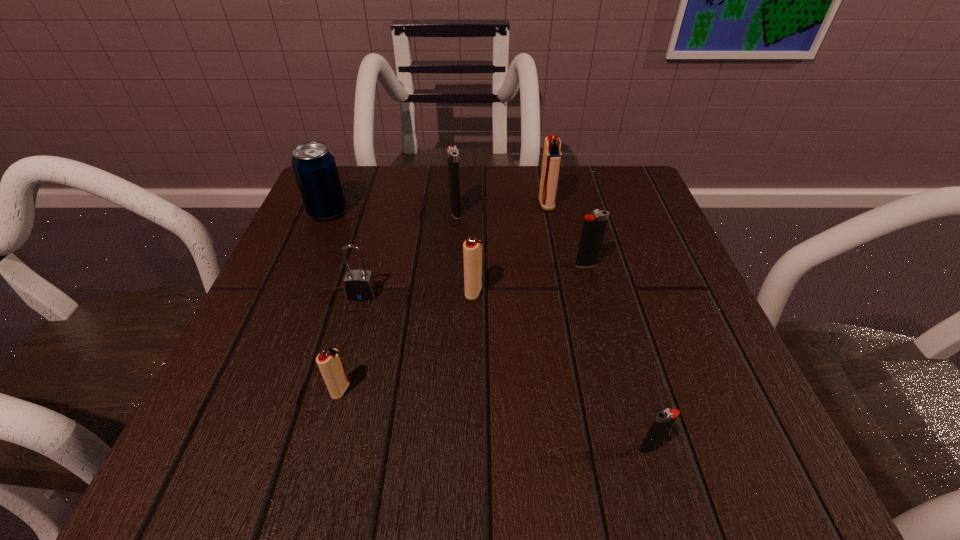
I want to click on the fourth igniter from left to right, so click(552, 156).

The width and height of the screenshot is (960, 540). I want to click on the biggest red igniter, so click(552, 156).

You are a GUI agent. You are given a task and a screenshot of the screen. Output one action in this format:
    pyautogui.click(x=<x>, y=<y>)
    Task: Click on the fourth object from left to right
    The width and height of the screenshot is (960, 540).
    Given the screenshot: What is the action you would take?
    pyautogui.click(x=452, y=152)

The width and height of the screenshot is (960, 540). Find the location of `the farthest black igniter`. the farthest black igniter is located at coordinates (452, 152).

Identify the location of soda can. Image resolution: width=960 pixels, height=540 pixels. (314, 166).

Where is `the third farthest igniter`? The width and height of the screenshot is (960, 540). the third farthest igniter is located at coordinates (593, 230).

Image resolution: width=960 pixels, height=540 pixels. Find the location of `the second biggest black igniter`. the second biggest black igniter is located at coordinates (x=593, y=230).

In order to click on the second red igniter from left to right in this screenshot , I will do `click(472, 248)`.

Find the location of a particular element. the fourth object from right to left is located at coordinates (472, 248).

Locate an element on the screen. The height and width of the screenshot is (540, 960). padlock is located at coordinates (359, 285).